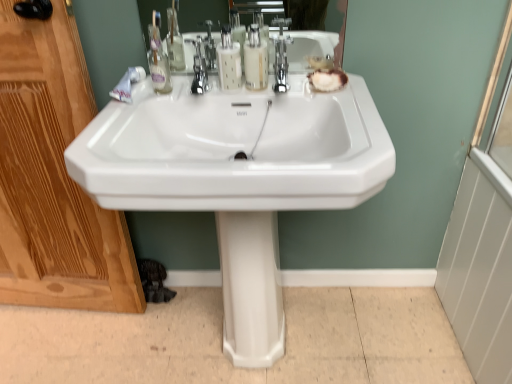
Question: Is translucent plastic soap dispenser at center, which is counted as the second soap dispenser, starting from the right, bigger or smaller than white glossy sink at center?

Choices:
 (A) small
 (B) big

Answer: (A)

Question: From the image's perspective, relative to white glossy sink at center, is translucent plastic soap dispenser at center, which is counted as the second soap dispenser, starting from the right, above or below?

Choices:
 (A) below
 (B) above

Answer: (B)

Question: Which is farther from the translucent plastic soap dispenser at center, acting as the first soap dispenser starting from the right?

Choices:
 (A) white glossy sink at center
 (B) translucent plastic soap dispenser at center, which is counted as the second soap dispenser, starting from the right
 (C) polished chrome faucet at center
 (D) wooden screen door at left
 (E) white glossy pedestal at center

Answer: (D)

Question: Based on their relative distances, which object is nearer to the wooden screen door at left?

Choices:
 (A) translucent plastic soap dispenser at center, marked as the first soap dispenser in a left-to-right arrangement
 (B) polished chrome faucet at center
 (C) translucent plastic soap dispenser at center, acting as the first soap dispenser starting from the right
 (D) white glossy pedestal at center
 (E) white glossy sink at center

Answer: (E)